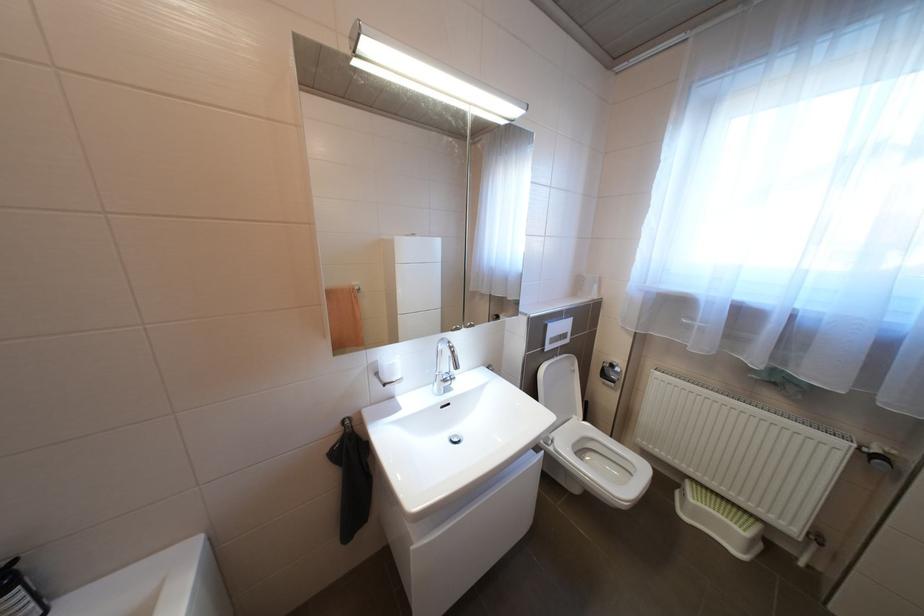
Where is `black dispenser pump`? black dispenser pump is located at coordinates (18, 593).